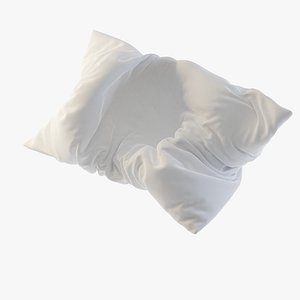
Where is `lower right corner of the pillow`? The height and width of the screenshot is (300, 300). lower right corner of the pillow is located at coordinates (193, 230).